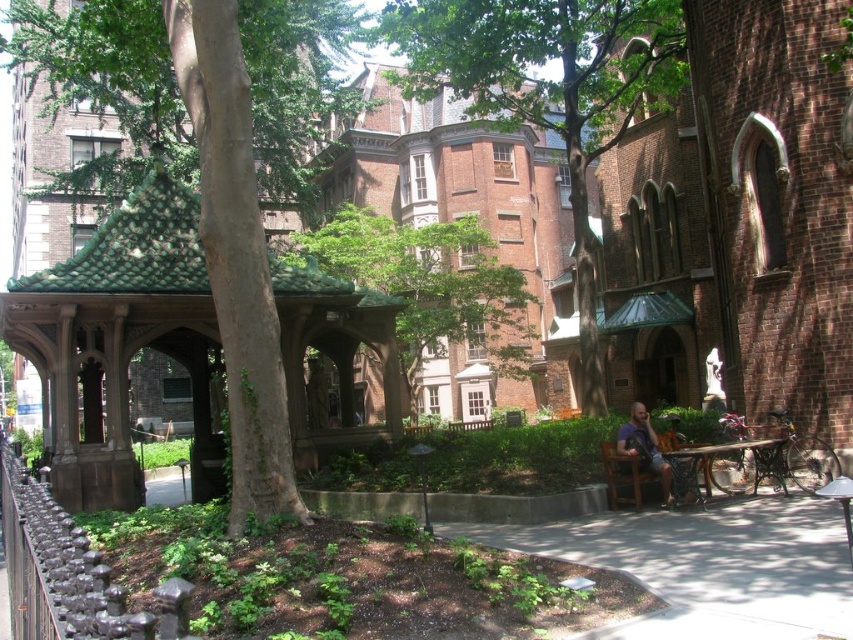
Which of these two, green tile gazebo at left or dark blue shirt at center, stands taller?

green tile gazebo at left is taller.

Between point (338, 340) and point (618, 451), which one is positioned in front?

Point (618, 451) is more forward.

Describe the element at coordinates (115, 340) in the screenshot. I see `green tile gazebo at left` at that location.

You are a GUI agent. You are given a task and a screenshot of the screen. Output one action in this format:
    pyautogui.click(x=<x>, y=<y>)
    Task: Click on the green tile gazebo at left
    Image resolution: width=853 pixels, height=640 pixels.
    Given the screenshot: What is the action you would take?
    pyautogui.click(x=115, y=340)

This screenshot has width=853, height=640. What do you see at coordinates (115, 340) in the screenshot?
I see `green tile gazebo at left` at bounding box center [115, 340].

Is point (68, 484) closer to viewer compared to point (709, 458)?

No, it is behind (709, 458).

What do you see at coordinates (115, 340) in the screenshot? Image resolution: width=853 pixels, height=640 pixels. I see `green tile gazebo at left` at bounding box center [115, 340].

Identify the location of green tile gazebo at left. (115, 340).

Can you confirm if green textured gazebo at center is shorter than wooden picnic table at lower right?

In fact, green textured gazebo at center may be taller than wooden picnic table at lower right.

Which is behind, point (519, 323) or point (699, 456)?

The point (519, 323) is more distant.

Between point (448, 221) and point (769, 442), which one is positioned behind?

Point (448, 221)

In order to click on green textured gazebo at center in this screenshot , I will do `click(428, 285)`.